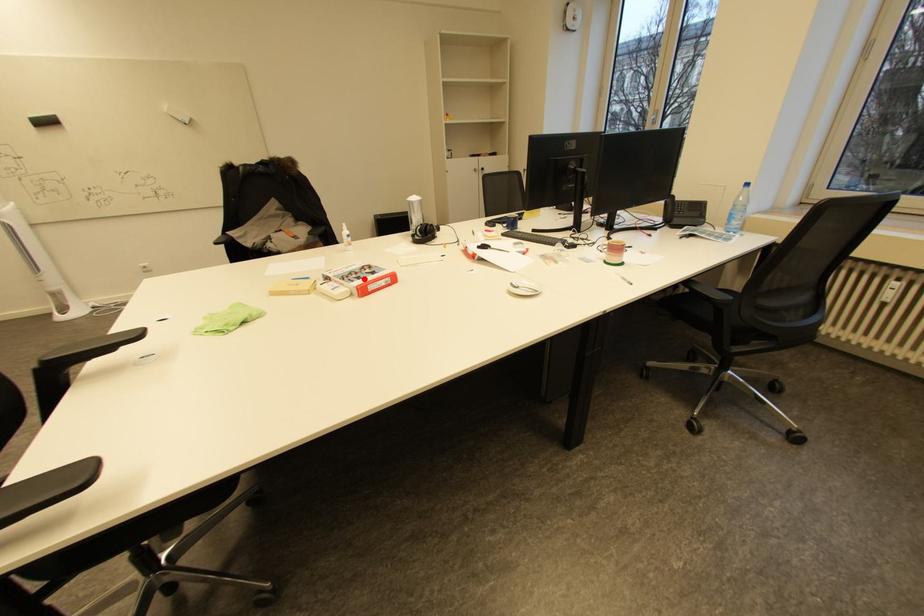
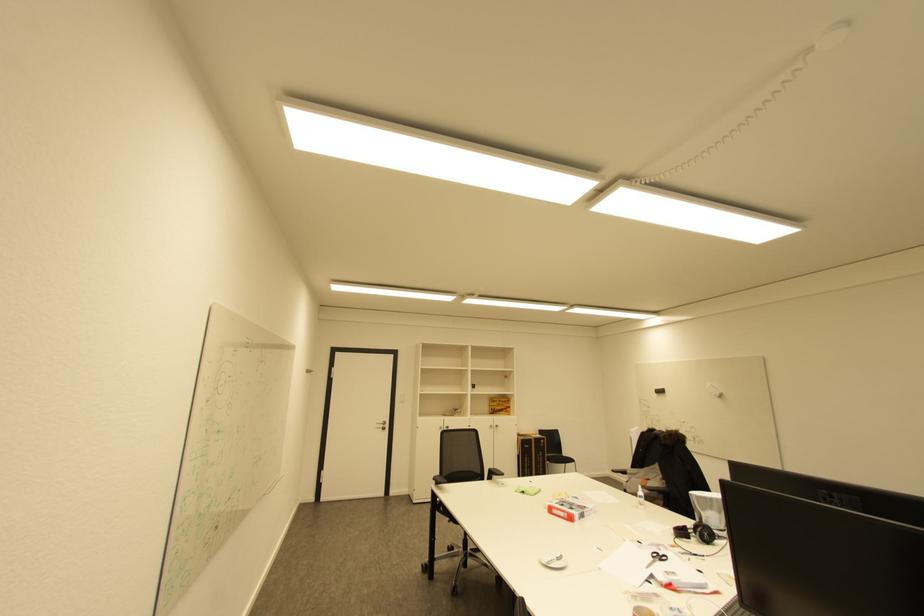
Locate, in the second image, the point that corresponds to the highlighted location in the first image.

(568, 506)